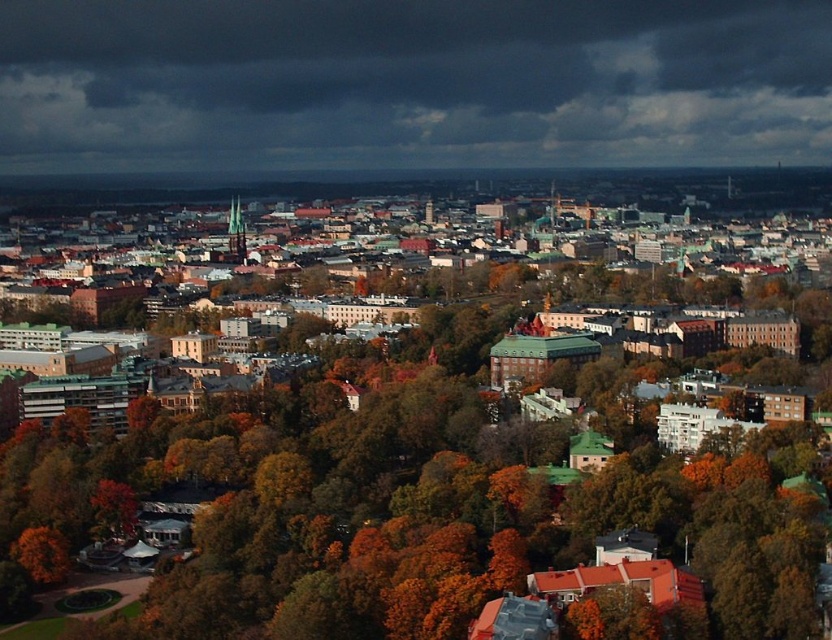
You are an architect planning to build a new skyscraper in the city. You want to ensure that the new building does not block the view of the orange leafy tree at lower left from the dark gray cloud at upper center. Given their relative sizes, is this feasible?

The dark gray cloud at upper center is much taller than the orange leafy tree at lower left. Since the cloud is taller, the new skyscraper could potentially be built between them without blocking the view, provided its height is less than the difference in their sizes.

You are a drone operator who needs to fly a drone from point A to point B. The coordinates for point A are point [707,497] and point B are point [35,548]. Given the cityscape described, which point is closer to the camera, and thus requires less altitude adjustment for the drone to reach it?

Point [707,497] is closer to the camera than point [35,548], so it requires less altitude adjustment for the drone to reach it.